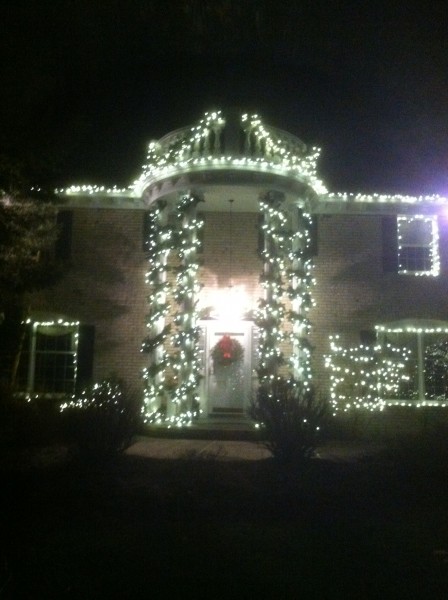
Locate an element on the screen. windows is located at coordinates (413, 238), (60, 359), (24, 360), (397, 343), (434, 344), (47, 235).